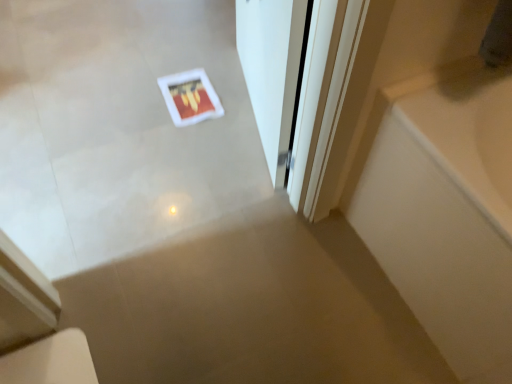
Question: Considering the positions of point (293, 49) and point (456, 306), is point (293, 49) closer or farther from the camera than point (456, 306)?

Choices:
 (A) farther
 (B) closer

Answer: (B)

Question: Relative to white glossy bathtub at right, is white glossy door at center in front or behind?

Choices:
 (A) behind
 (B) front

Answer: (A)

Question: Is white glossy door at center inside the boundaries of white glossy bathtub at right, or outside?

Choices:
 (A) outside
 (B) inside

Answer: (A)

Question: In the image, is white glossy bathtub at right on the left side or the right side of white glossy door at center?

Choices:
 (A) right
 (B) left

Answer: (A)

Question: Considering the positions of white glossy bathtub at right and white glossy door at center in the image, is white glossy bathtub at right wider or thinner than white glossy door at center?

Choices:
 (A) thin
 (B) wide

Answer: (B)

Question: Does point (361, 223) appear closer or farther from the camera than point (296, 49)?

Choices:
 (A) farther
 (B) closer

Answer: (A)

Question: Relative to white glossy door at center, is white glossy bathtub at right in front or behind?

Choices:
 (A) front
 (B) behind

Answer: (A)